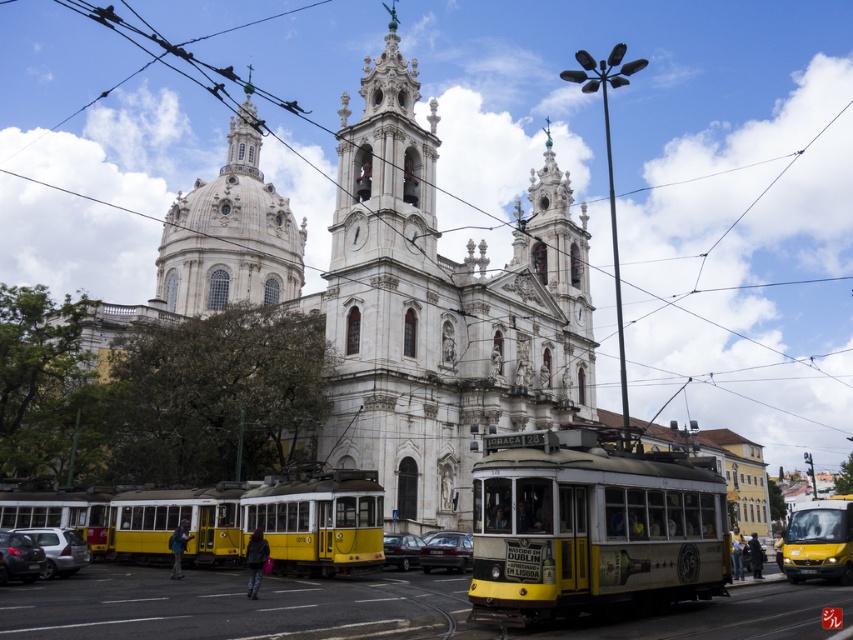
Between white marble church at center and white stone dome at upper center, which one has less height?

With less height is white stone dome at upper center.

Between white marble church at center and white stone dome at upper center, which one appears on the left side from the viewer's perspective?

white marble church at center

Identify the location of white marble church at center. The height and width of the screenshot is (640, 853). point(399,296).

Between point (842, 512) and point (55, 566), which one is positioned in front?

Positioned in front is point (55, 566).

Can you confirm if yellow matte van at center is positioned to the left of silver metallic car at lower left?

No, yellow matte van at center is not to the left of silver metallic car at lower left.

Does point (821, 536) come behind point (62, 570)?

Yes, it is behind point (62, 570).

The width and height of the screenshot is (853, 640). Identify the location of yellow matte van at center. (819, 540).

Is point (44, 544) positioned in front of point (392, 552)?

Yes, it is in front of point (392, 552).

Is point (83, 557) farther from camera compared to point (399, 556)?

That is False.

Is point (71, 540) positioned in front of point (387, 550)?

That is True.

The height and width of the screenshot is (640, 853). Identify the location of silver metallic car at lower left. (59, 548).